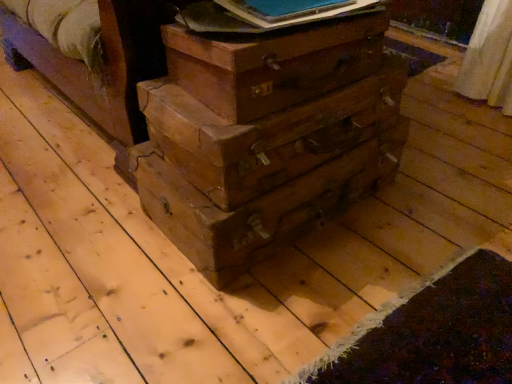
You are a GUI agent. You are given a task and a screenshot of the screen. Output one action in this format:
    pyautogui.click(x=<x>, y=<y>)
    Task: Click on the vacant space that is to the left of wooden drawer at center, which is counted as the 1th drawer, starting from the bottom
    The height and width of the screenshot is (384, 512).
    Given the screenshot: What is the action you would take?
    pyautogui.click(x=72, y=228)